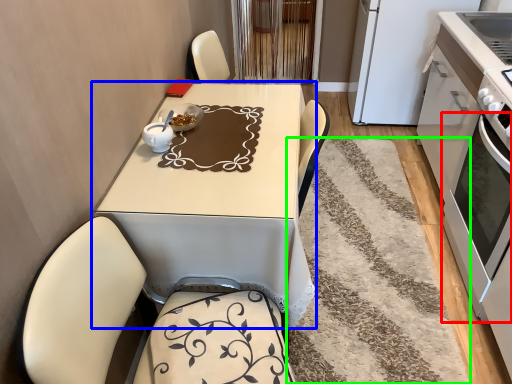
Question: Which object is the farthest from oven (highlighted by a red box)? Choose among these: table (highlighted by a blue box) or mat (highlighted by a green box).

Choices:
 (A) table
 (B) mat

Answer: (A)